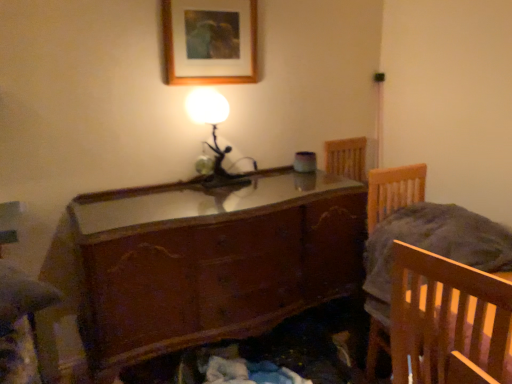
Question: Is wooden glossy chest of drawers at center at the right side of matte glass table lamp at upper center?

Choices:
 (A) no
 (B) yes

Answer: (B)

Question: From a real-world perspective, is wooden glossy chest of drawers at center under matte glass table lamp at upper center?

Choices:
 (A) yes
 (B) no

Answer: (A)

Question: Could you tell me if wooden glossy chest of drawers at center is turned towards matte glass table lamp at upper center?

Choices:
 (A) no
 (B) yes

Answer: (A)

Question: Is wooden glossy chest of drawers at center positioned beyond the bounds of matte glass table lamp at upper center?

Choices:
 (A) yes
 (B) no

Answer: (A)

Question: Is wooden glossy chest of drawers at center to the left of matte glass table lamp at upper center from the viewer's perspective?

Choices:
 (A) no
 (B) yes

Answer: (A)

Question: In terms of size, does wooden glossy chest of drawers at center appear bigger or smaller than matte glass table lamp at upper center?

Choices:
 (A) big
 (B) small

Answer: (A)

Question: Is wooden glossy chest of drawers at center in front of or behind matte glass table lamp at upper center in the image?

Choices:
 (A) front
 (B) behind

Answer: (A)

Question: From a real-world perspective, is wooden glossy chest of drawers at center above or below matte glass table lamp at upper center?

Choices:
 (A) above
 (B) below

Answer: (B)

Question: Is wooden glossy chest of drawers at center taller or shorter than matte glass table lamp at upper center?

Choices:
 (A) short
 (B) tall

Answer: (B)

Question: Would you say wooden picture frame at upper center is to the left or to the right of wooden glossy chest of drawers at center in the picture?

Choices:
 (A) right
 (B) left

Answer: (B)

Question: Is wooden picture frame at upper center wider or thinner than wooden glossy chest of drawers at center?

Choices:
 (A) thin
 (B) wide

Answer: (A)

Question: Considering the positions of point (183, 21) and point (343, 200), is point (183, 21) closer or farther from the camera than point (343, 200)?

Choices:
 (A) farther
 (B) closer

Answer: (B)

Question: Looking at the image, does wooden picture frame at upper center seem bigger or smaller compared to wooden glossy chest of drawers at center?

Choices:
 (A) small
 (B) big

Answer: (A)

Question: Is point (230, 322) positioned closer to the camera than point (369, 334)?

Choices:
 (A) closer
 (B) farther

Answer: (A)

Question: Considering the positions of wooden glossy chest of drawers at center and wooden bed frame at right in the image, is wooden glossy chest of drawers at center taller or shorter than wooden bed frame at right?

Choices:
 (A) short
 (B) tall

Answer: (A)